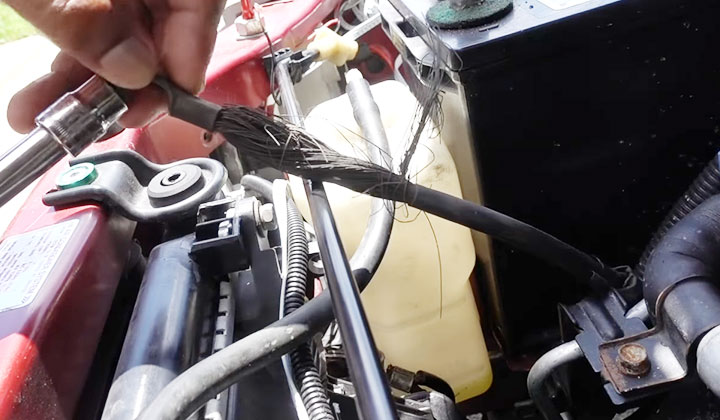
Where is `red cylinder knob`? The image size is (720, 420). red cylinder knob is located at coordinates (248, 10).